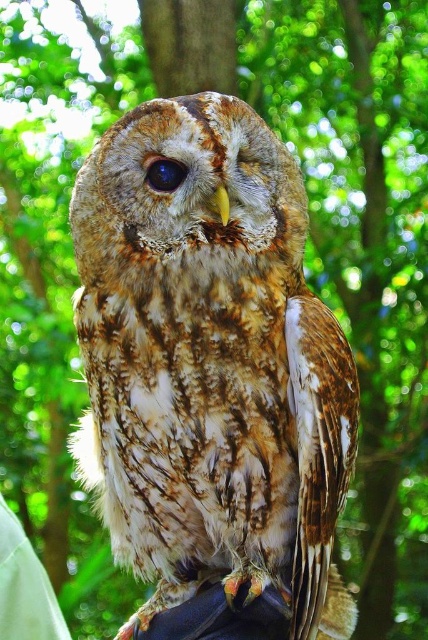
The image size is (428, 640). What do you see at coordinates (211, 365) in the screenshot? I see `brown speckled feathers at center` at bounding box center [211, 365].

Is point (190, 147) closer to viewer compared to point (21, 538)?

Yes, it is in front of point (21, 538).

Locate an element on the screen. The height and width of the screenshot is (640, 428). brown speckled feathers at center is located at coordinates (211, 365).

Image resolution: width=428 pixels, height=640 pixels. Identify the location of brown speckled feathers at center. (211, 365).

Who is higher up, brown speckled feathers at center or brown textured eye at center?

brown textured eye at center

Is point (262, 356) farther from camera compared to point (149, 172)?

Yes, it is behind point (149, 172).

Locate an element on the screen. The image size is (428, 640). brown speckled feathers at center is located at coordinates (211, 365).

What do you see at coordinates (24, 588) in the screenshot? I see `white fabric at lower left` at bounding box center [24, 588].

Does white fabric at lower left have a greater width compared to brown textured eye at center?

Yes, white fabric at lower left is wider than brown textured eye at center.

Locate an element on the screen. white fabric at lower left is located at coordinates (24, 588).

Locate an element on the screen. The height and width of the screenshot is (640, 428). white fabric at lower left is located at coordinates (24, 588).